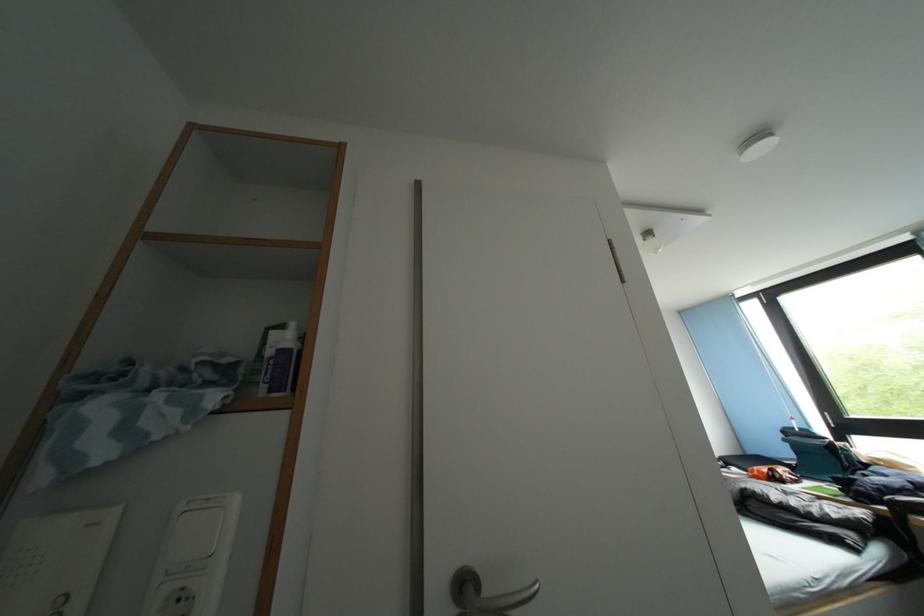
Identify the location of cardboard box. This screenshot has width=924, height=616. (55, 562).